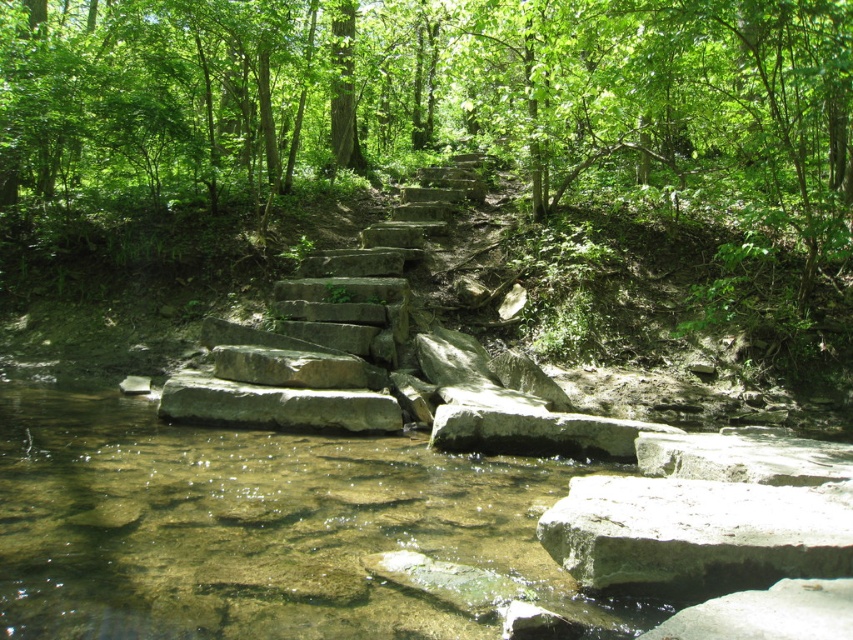
Question: From the image, what is the correct spatial relationship of clear stone water at center in relation to gray rough rock at lower center?

Choices:
 (A) left
 (B) right

Answer: (A)

Question: Which object appears closest to the camera in this image?

Choices:
 (A) gray rough rock at lower center
 (B) clear stone water at center

Answer: (A)

Question: Is gray rough rock at lower center wider than gray stone boulder at center?

Choices:
 (A) no
 (B) yes

Answer: (A)

Question: Can you confirm if clear stone water at center is smaller than gray stone boulder at center?

Choices:
 (A) yes
 (B) no

Answer: (A)

Question: Which point is closer to the camera?

Choices:
 (A) gray rough rock at lower center
 (B) gray stone boulder at center

Answer: (A)

Question: Which object appears farthest from the camera in this image?

Choices:
 (A) gray rough rock at lower center
 (B) clear stone water at center

Answer: (B)